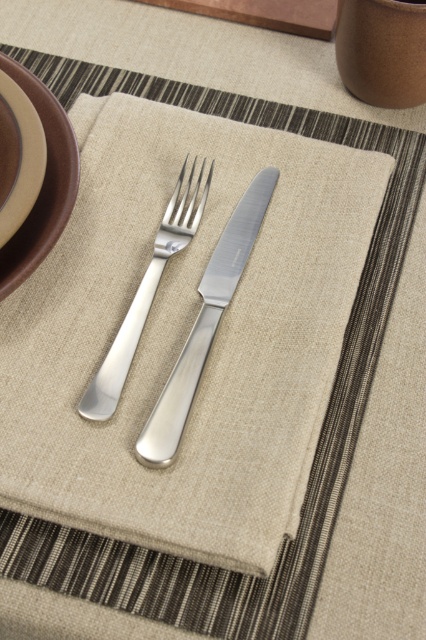
Can you confirm if brown ceramic platter at upper left is positioned above matte brown platter at left?

Incorrect, brown ceramic platter at upper left is not positioned above matte brown platter at left.

Between brown ceramic platter at upper left and matte brown platter at left, which one has less height?

With less height is matte brown platter at left.

Is point (57, 198) closer to viewer compared to point (28, 168)?

That is False.

The image size is (426, 640). Identify the location of brown ceramic platter at upper left. (42, 188).

Who is positioned more to the right, brown ceramic platter at upper left or polished silver fork at center?

From the viewer's perspective, polished silver fork at center appears more on the right side.

Is brown ceramic platter at upper left thinner than polished silver fork at center?

Correct, brown ceramic platter at upper left's width is less than polished silver fork at center's.

Is point (9, 64) less distant than point (172, 244)?

No, (9, 64) is behind (172, 244).

Where is `brown ceramic platter at upper left`? This screenshot has width=426, height=640. brown ceramic platter at upper left is located at coordinates (42, 188).

Is point (158, 412) positioned behind point (92, 385)?

No, it is in front of (92, 385).

Between polished silver knife at center and polished silver fork at center, which one has more height?

polished silver knife at center is taller.

Based on the photo, who is more forward, (209, 332) or (146, 273)?

Positioned in front is point (209, 332).

Locate an element on the screen. Image resolution: width=426 pixels, height=640 pixels. polished silver knife at center is located at coordinates (204, 323).